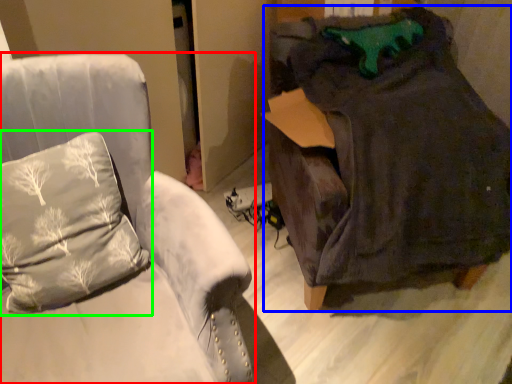
Question: Considering the real-world distances, which object is closest to furniture (highlighted by a red box)? bean bag chair (highlighted by a blue box) or pillow (highlighted by a green box).

Choices:
 (A) bean bag chair
 (B) pillow

Answer: (B)